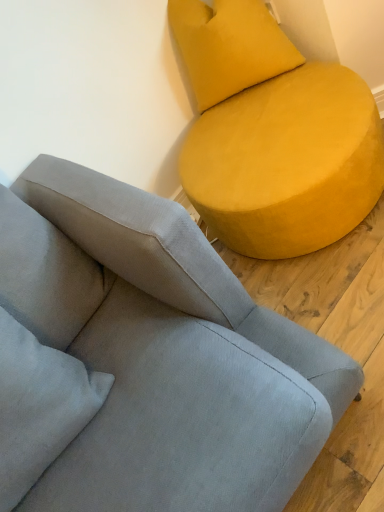
Question: From the image's perspective, does suede gray couch at upper right, which is counted as the 2th studio couch, starting from the right, appear higher than velvet yellow pillow at upper right?

Choices:
 (A) no
 (B) yes

Answer: (A)

Question: Is suede gray couch at upper right, which appears as the first studio couch when viewed from the left, turned away from velvet yellow pillow at upper right?

Choices:
 (A) no
 (B) yes

Answer: (A)

Question: Is suede gray couch at upper right, which appears as the first studio couch when viewed from the left, at the right side of velvet yellow pillow at upper right?

Choices:
 (A) yes
 (B) no

Answer: (B)

Question: Does suede gray couch at upper right, which appears as the first studio couch when viewed from the left, have a greater width compared to velvet yellow pillow at upper right?

Choices:
 (A) no
 (B) yes

Answer: (B)

Question: Is velvet yellow pillow at upper right completely or partially inside suede gray couch at upper right, which appears as the first studio couch when viewed from the left?

Choices:
 (A) no
 (B) yes

Answer: (A)

Question: Considering the relative sizes of suede gray couch at upper right, which is counted as the 2th studio couch, starting from the right, and velvet yellow pillow at upper right in the image provided, is suede gray couch at upper right, which is counted as the 2th studio couch, starting from the right, shorter than velvet yellow pillow at upper right?

Choices:
 (A) yes
 (B) no

Answer: (B)

Question: Considering the relative positions of velvet yellow pillow at upper right and suede gray couch at upper right, which appears as the first studio couch when viewed from the left, in the image provided, is velvet yellow pillow at upper right to the right of suede gray couch at upper right, which appears as the first studio couch when viewed from the left, from the viewer's perspective?

Choices:
 (A) no
 (B) yes

Answer: (B)

Question: Can you confirm if velvet yellow pillow at upper right is bigger than suede gray couch at upper right, which appears as the first studio couch when viewed from the left?

Choices:
 (A) no
 (B) yes

Answer: (A)

Question: Would you say velvet yellow pillow at upper right is a long distance from suede gray couch at upper right, which is counted as the 2th studio couch, starting from the right?

Choices:
 (A) yes
 (B) no

Answer: (B)

Question: Is suede gray couch at upper right, which appears as the first studio couch when viewed from the left, located within velvet yellow pillow at upper right?

Choices:
 (A) no
 (B) yes

Answer: (A)

Question: Considering the relative positions of velvet yellow pillow at upper right and suede gray couch at upper right, which is counted as the 2th studio couch, starting from the right, in the image provided, is velvet yellow pillow at upper right to the left of suede gray couch at upper right, which is counted as the 2th studio couch, starting from the right, from the viewer's perspective?

Choices:
 (A) yes
 (B) no

Answer: (B)

Question: Considering the relative sizes of velvet yellow pillow at upper right and suede gray couch at upper right, which appears as the first studio couch when viewed from the left, in the image provided, is velvet yellow pillow at upper right taller than suede gray couch at upper right, which appears as the first studio couch when viewed from the left,?

Choices:
 (A) no
 (B) yes

Answer: (A)

Question: Is matte yellow ottoman at upper right, the 1th studio couch when ordered from right to left, positioned before suede gray couch at upper right, which appears as the first studio couch when viewed from the left?

Choices:
 (A) no
 (B) yes

Answer: (A)